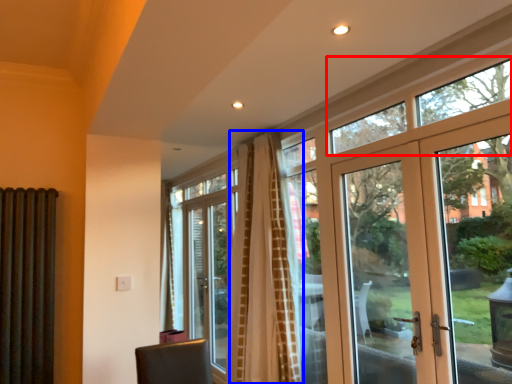
Question: Which point is closer to the camera, window (highlighted by a red box) or curtain (highlighted by a blue box)?

Choices:
 (A) window
 (B) curtain

Answer: (A)